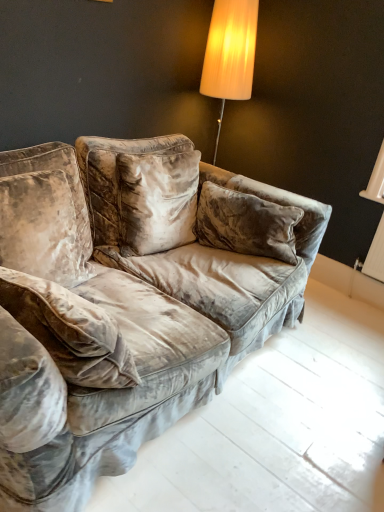
What do you see at coordinates (128, 300) in the screenshot? I see `velvet couch at center` at bounding box center [128, 300].

The height and width of the screenshot is (512, 384). Find the location of `velvet couch at center`. velvet couch at center is located at coordinates (128, 300).

Locate an element on the screen. velvet couch at center is located at coordinates (128, 300).